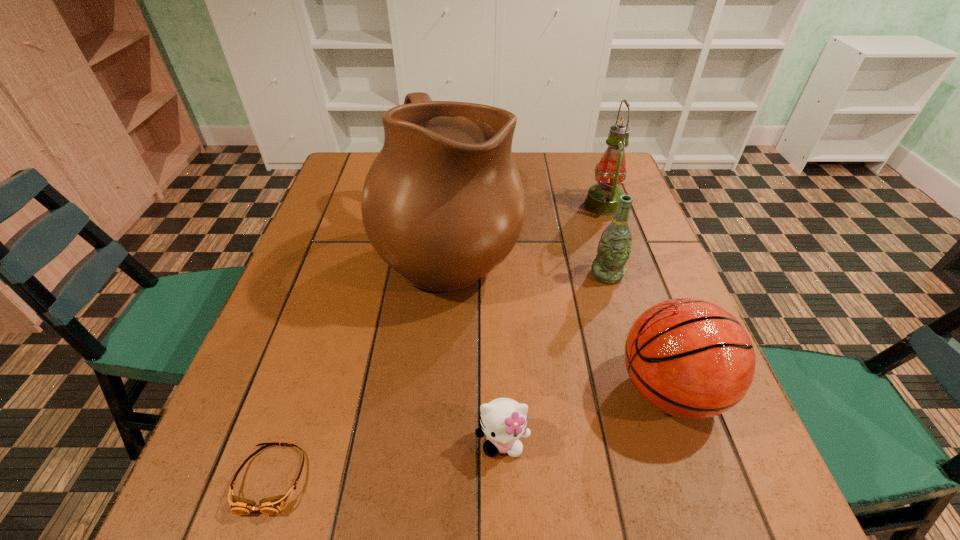
This screenshot has width=960, height=540. What are the coordinates of `unoccupied area between the kitten and the basketball` in the screenshot? It's located at (586, 415).

Where is `vacant space that is in between the oil lamp and the second shortest object`? This screenshot has width=960, height=540. vacant space that is in between the oil lamp and the second shortest object is located at coordinates (553, 323).

Image resolution: width=960 pixels, height=540 pixels. Find the location of `vacant space that's between the oil lamp and the shortest object`. vacant space that's between the oil lamp and the shortest object is located at coordinates (437, 342).

Identify the location of unoccupied position between the shortest object and the oil lamp. (437, 342).

In order to click on the fourth closest object relative to the shortest object in this screenshot , I will do (614, 248).

Identify the location of object identified as the fifth closest to the kitten. The height and width of the screenshot is (540, 960). (602, 198).

At what (x,y) coordinates should I click in order to perform the action: click on free location that satisfies the following two spatial constraints: 1. on the side with spill of the basketball; 2. with the lenses facing forward on the shortest object. Please return your answer as a coordinate pair (x, y). Looking at the image, I should click on (701, 478).

This screenshot has width=960, height=540. Identify the location of vacant space that satisfies the following two spatial constraints: 1. on the side with spill of the basketball; 2. on the front-facing side of the second shortest object. (687, 441).